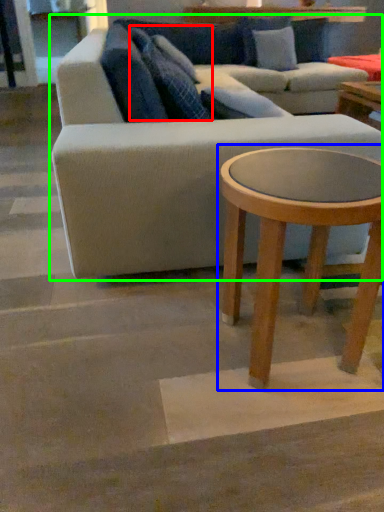
Question: Estimate the real-world distances between objects in this image. Which object is farther from pillow (highlighted by a red box), coffee table (highlighted by a blue box) or studio couch (highlighted by a green box)?

Choices:
 (A) coffee table
 (B) studio couch

Answer: (A)